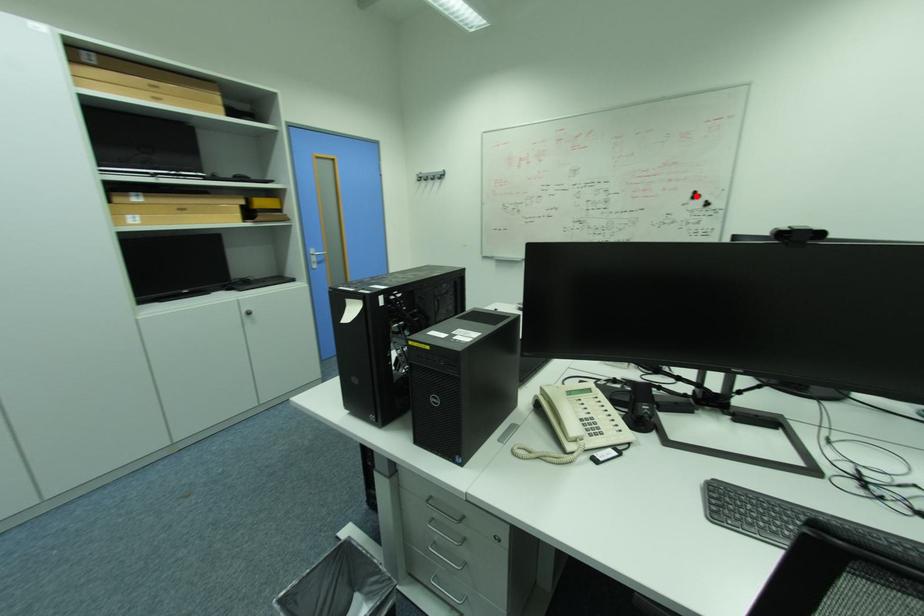
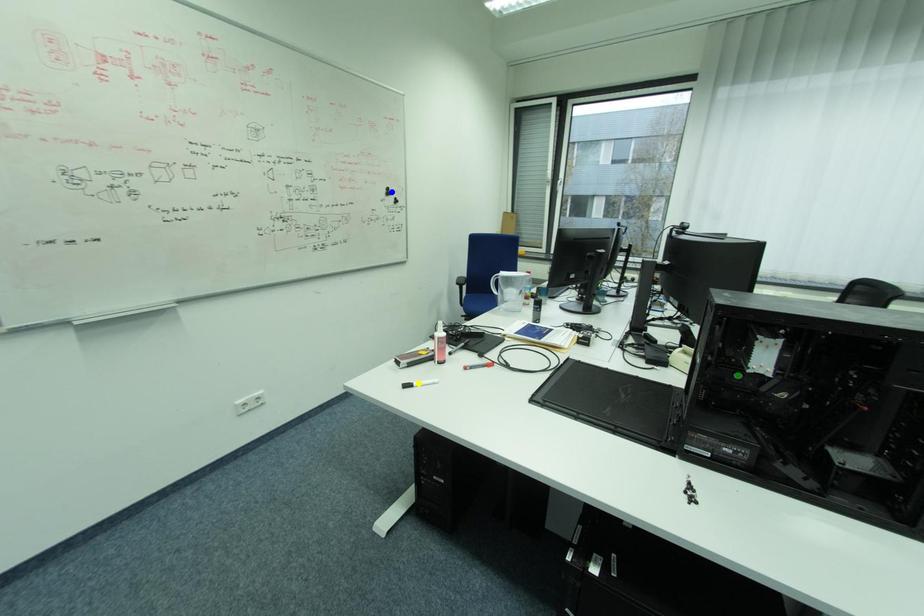
Question: I am providing you with two images of the same scene from different viewpoints. A red point is marked on the first image. You are given multiple points on the second image. Which point in image 2 is actually the same real-world point as the red point in image 1?

Choices:
 (A) blue point
 (B) green point
 (C) yellow point

Answer: (A)